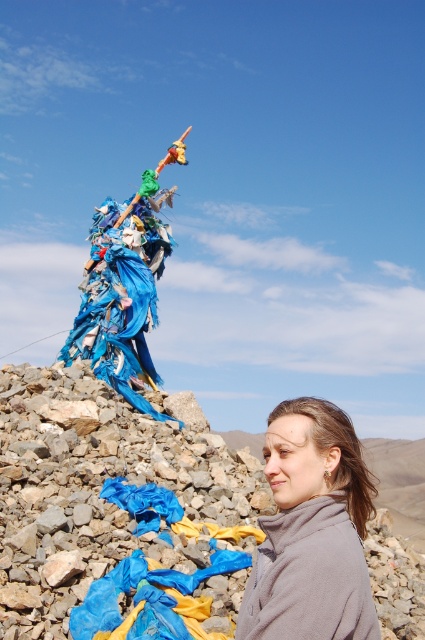
You are an observer standing in front of the scene. You notice the blue fabric at lower left and the gray fleece jacket at center. Which object is positioned lower in the image?

The blue fabric at lower left is positioned lower than the gray fleece jacket at center.

You are a photographer trying to capture the blue fabric at lower left and the gray fleece jacket at center in the same frame. Based on their sizes, do you think both objects can fit in the camera viewfinder without zooming in or out?

The blue fabric at lower left might be wider than gray fleece jacket at center, so there is a possibility that the blue fabric at lower left could occupy more space in the frame. However, without exact measurements, it is uncertain if both will fit perfectly in the camera viewfinder without adjusting the zoom.

You are a photographer trying to capture both the blue fabric at lower left and the gray fleece jacket at center in a single frame. Based on their heights, which object will appear larger in the photo?

The blue fabric at lower left is taller than the gray fleece jacket at center, so it will appear larger in the photo.